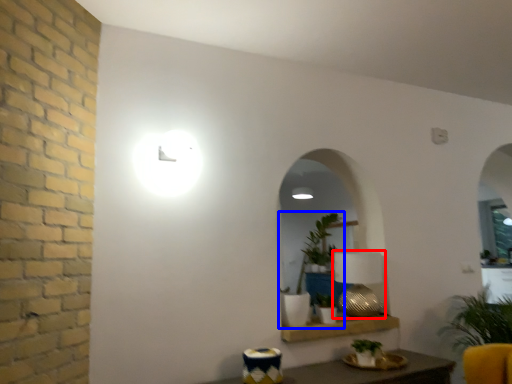
Question: Which point is closer to the camera, table lamp (highlighted by a red box) or houseplant (highlighted by a blue box)?

Choices:
 (A) table lamp
 (B) houseplant

Answer: (B)